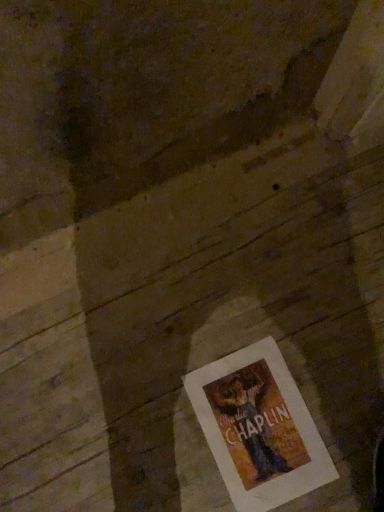
You are a GUI agent. You are given a task and a screenshot of the screen. Output one action in this format:
    pyautogui.click(x=<x>, y=<y>)
    Task: Click on the vacant space situated above matte paper poster at lower center (from a real-world perspective)
    
    Given the screenshot: What is the action you would take?
    pyautogui.click(x=255, y=431)